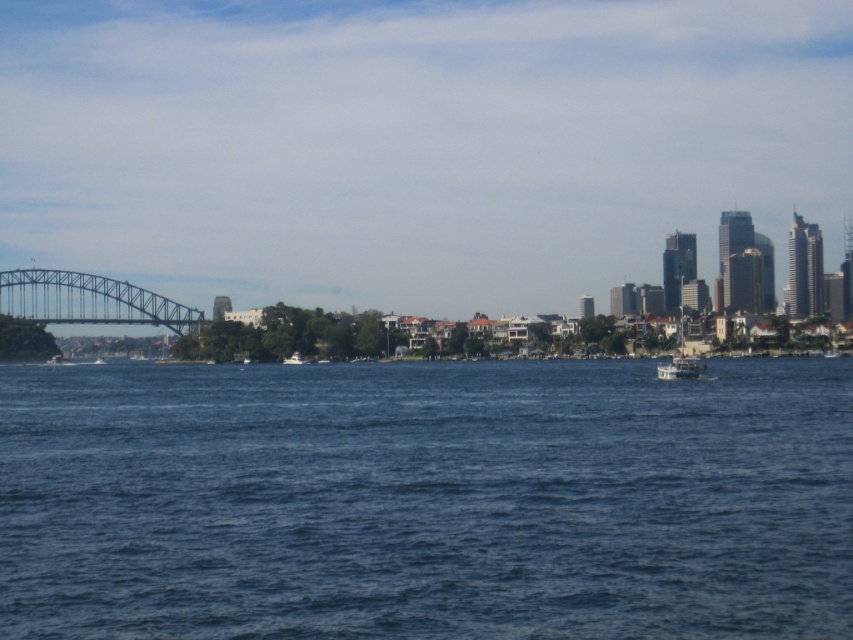
Which is in front, point (0, 296) or point (701, 364)?

Point (701, 364) is in front.

Does metallic steel bridge at left appear on the left side of white plastic boat at center?

Yes, metallic steel bridge at left is to the left of white plastic boat at center.

Which is behind, point (0, 285) or point (671, 372)?

Point (0, 285)

You are a GUI agent. You are given a task and a screenshot of the screen. Output one action in this format:
    pyautogui.click(x=<x>, y=<y>)
    Task: Click on the metallic steel bridge at left
    
    Given the screenshot: What is the action you would take?
    pyautogui.click(x=90, y=300)

Is blue water at center bigger than white plastic boat at center?

Yes, blue water at center is bigger than white plastic boat at center.

Does blue water at center have a greater height compared to white plastic boat at center?

Indeed, blue water at center has a greater height compared to white plastic boat at center.

Is point (561, 413) closer to camera compared to point (688, 365)?

That is True.

Locate an element on the screen. This screenshot has height=640, width=853. blue water at center is located at coordinates (426, 500).

Does blue water at center appear on the right side of white glossy boat at center?

Yes, blue water at center is to the right of white glossy boat at center.

I want to click on blue water at center, so click(x=426, y=500).

Identify the location of blue water at center. (426, 500).